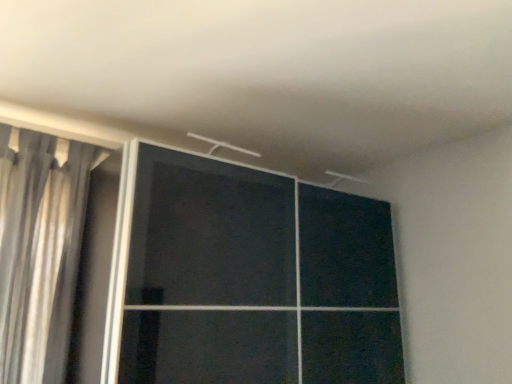
Question: Is silky gray curtain at left in front of or behind transparent glass door at center in the image?

Choices:
 (A) behind
 (B) front

Answer: (A)

Question: From a real-world perspective, relative to transparent glass door at center, is silky gray curtain at left vertically above or below?

Choices:
 (A) above
 (B) below

Answer: (A)

Question: Is silky gray curtain at left bigger or smaller than transparent glass door at center?

Choices:
 (A) big
 (B) small

Answer: (B)

Question: In terms of width, does transparent glass door at center look wider or thinner when compared to silky gray curtain at left?

Choices:
 (A) thin
 (B) wide

Answer: (B)

Question: Is transparent glass door at center in front of or behind silky gray curtain at left in the image?

Choices:
 (A) front
 (B) behind

Answer: (A)

Question: Is point (161, 334) closer or farther from the camera than point (57, 283)?

Choices:
 (A) farther
 (B) closer

Answer: (B)

Question: Is transparent glass door at center situated inside silky gray curtain at left or outside?

Choices:
 (A) inside
 (B) outside

Answer: (B)